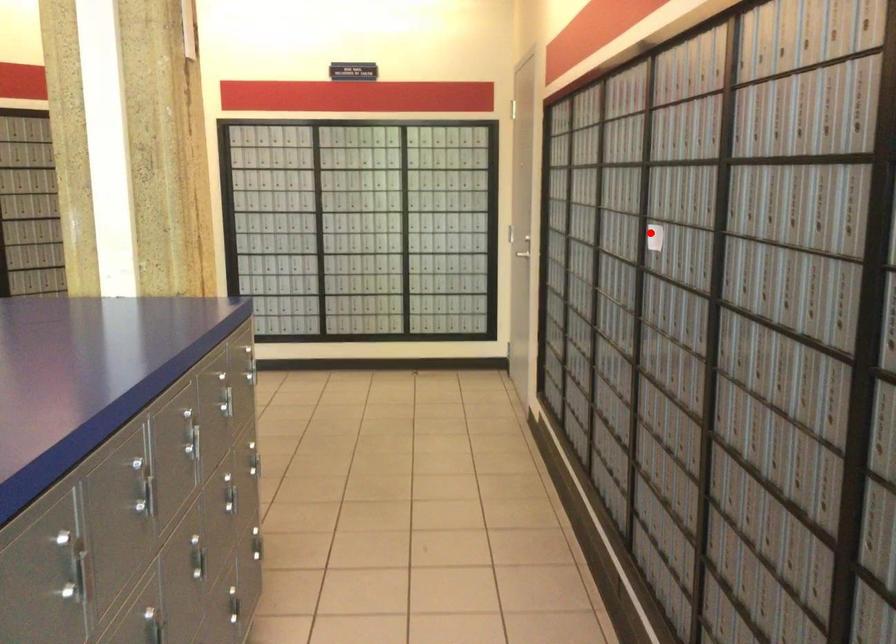
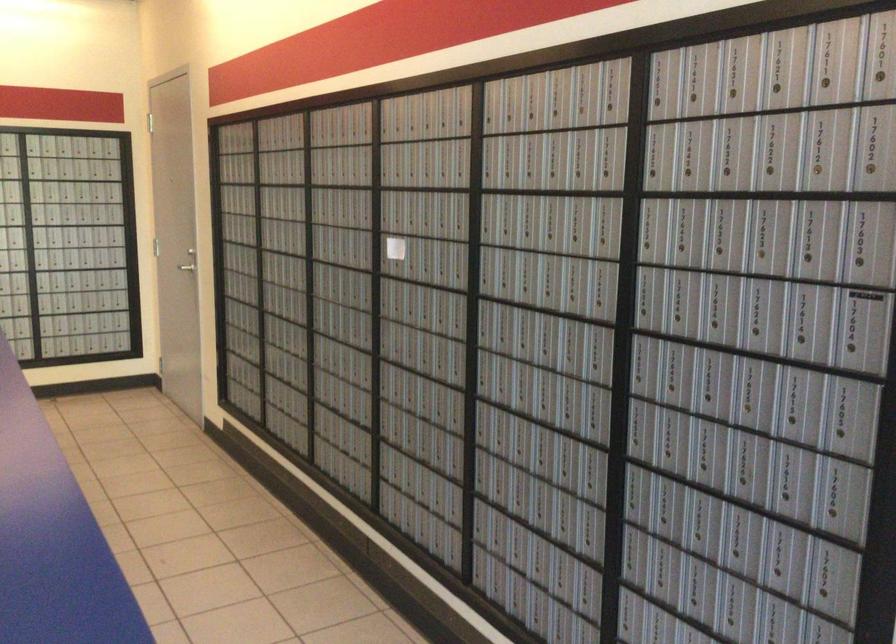
Question: A red point is marked in image1. In image2, is the corresponding 3D point closer to the camera or farther? Reply with the corresponding letter.

Choices:
 (A) The corresponding 3D point is closer.
 (B) The corresponding 3D point is farther.

Answer: (B)